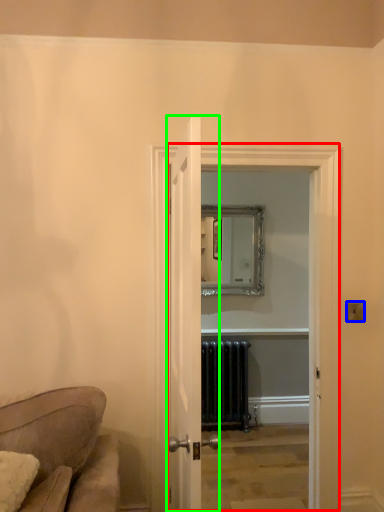
Question: Considering the real-world distances, which object is closest to glass door (highlighted by a red box)? light switch (highlighted by a blue box) or door (highlighted by a green box).

Choices:
 (A) light switch
 (B) door

Answer: (A)